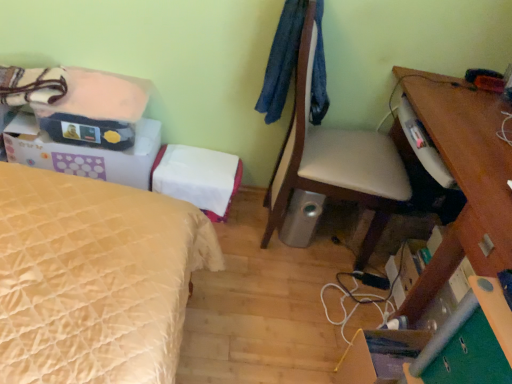
Where is `white cardboard box at upper left, which is the 3th storage box from bottom to top`? white cardboard box at upper left, which is the 3th storage box from bottom to top is located at coordinates (84, 153).

Image resolution: width=512 pixels, height=384 pixels. Describe the element at coordinates (470, 357) in the screenshot. I see `green felt drawer at lower right` at that location.

This screenshot has width=512, height=384. What do you see at coordinates (99, 96) in the screenshot? I see `matte black bag at upper left` at bounding box center [99, 96].

This screenshot has width=512, height=384. Find the location of `white fabric storage box at center, which is counted as the second storage box, starting from the top`. white fabric storage box at center, which is counted as the second storage box, starting from the top is located at coordinates (198, 177).

This screenshot has height=384, width=512. Find the location of `white cardboard box at upper left, marked as the 1th storage box in a top-to-bottom arrangement`. white cardboard box at upper left, marked as the 1th storage box in a top-to-bottom arrangement is located at coordinates (84, 153).

Is silver metallic speaker at lower center in contact with matte black bag at upper left?

They are not placed beside each other.

The width and height of the screenshot is (512, 384). Find the location of `loudspeaker behind the matte black bag at upper left`. loudspeaker behind the matte black bag at upper left is located at coordinates (301, 218).

Can you tell me how much silver metallic speaker at lower center and matte black bag at upper left differ in facing direction?

The angular difference between silver metallic speaker at lower center and matte black bag at upper left is 0.817 degrees.

From the image's perspective, which one is positioned higher, silver metallic speaker at lower center or matte black bag at upper left?

matte black bag at upper left.

Does matte black bag at upper left have a larger size compared to white cardboard box at upper left, marked as the 1th storage box in a top-to-bottom arrangement?

No.

Which of these two, matte black bag at upper left or white cardboard box at upper left, acting as the 1th storage box starting from the left, stands shorter?

matte black bag at upper left is shorter.

From a real-world perspective, is matte black bag at upper left under white cardboard box at upper left, marked as the 1th storage box in a top-to-bottom arrangement?

No, from a real-world perspective, matte black bag at upper left is not beneath white cardboard box at upper left, marked as the 1th storage box in a top-to-bottom arrangement.

Is matte black bag at upper left wider or thinner than white cardboard box at upper left, which is the 3th storage box from bottom to top?

matte black bag at upper left is thinner than white cardboard box at upper left, which is the 3th storage box from bottom to top.

Is matte cardboard box at lower right, arranged as the 3th storage box when viewed from the top, oriented away from silver metallic speaker at lower center?

matte cardboard box at lower right, arranged as the 3th storage box when viewed from the top, does not have its back to silver metallic speaker at lower center.

Does matte cardboard box at lower right, which is counted as the third storage box, starting from the left, have a lesser width compared to silver metallic speaker at lower center?

Yes, matte cardboard box at lower right, which is counted as the third storage box, starting from the left, is thinner than silver metallic speaker at lower center.

From a real-world perspective, who is located lower, matte cardboard box at lower right, the 1th storage box from the bottom, or silver metallic speaker at lower center?

matte cardboard box at lower right, the 1th storage box from the bottom.

What's the angular difference between matte cardboard box at lower right, which is counted as the third storage box, starting from the left, and silver metallic speaker at lower center's facing directions?

They differ by 86.7 degrees in their facing directions.

Is white fabric storage box at center, marked as the 2th storage box in a left-to-right arrangement, at the back of silver metallic speaker at lower center?

That's not correct — silver metallic speaker at lower center is not looking away from white fabric storage box at center, marked as the 2th storage box in a left-to-right arrangement.

Considering the relative sizes of silver metallic speaker at lower center and white fabric storage box at center, marked as the 2th storage box in a left-to-right arrangement, in the image provided, is silver metallic speaker at lower center smaller than white fabric storage box at center, marked as the 2th storage box in a left-to-right arrangement,?

Yes, silver metallic speaker at lower center is smaller than white fabric storage box at center, marked as the 2th storage box in a left-to-right arrangement.

Considering the positions of objects silver metallic speaker at lower center and white fabric storage box at center, placed as the second storage box when sorted from bottom to top, in the image provided, who is more to the right, silver metallic speaker at lower center or white fabric storage box at center, placed as the second storage box when sorted from bottom to top,?

From the viewer's perspective, silver metallic speaker at lower center appears more on the right side.

Considering the positions of points (506, 235) and (305, 242), is point (506, 235) farther from camera compared to point (305, 242)?

No, it is in front of (305, 242).

Based on the photo, considering the positions of objects wooden desk at right and silver metallic speaker at lower center in the image provided, who is behind, wooden desk at right or silver metallic speaker at lower center?

silver metallic speaker at lower center.

Based on their positions, is wooden desk at right located to the left or right of silver metallic speaker at lower center?

Clearly, wooden desk at right is on the right of silver metallic speaker at lower center in the image.

From a real-world perspective, which object rests below the other?

silver metallic speaker at lower center.

Can you confirm if matte cardboard box at lower right, which is counted as the third storage box, starting from the left, is shorter than white fabric storage box at center, marked as the 2th storage box in a left-to-right arrangement?

In fact, matte cardboard box at lower right, which is counted as the third storage box, starting from the left, may be taller than white fabric storage box at center, marked as the 2th storage box in a left-to-right arrangement.

Which point is more distant from viewer, (395,382) or (186,165)?

The point (186,165) is more distant.

Considering the relative sizes of matte cardboard box at lower right, which is counted as the third storage box, starting from the left, and white fabric storage box at center, the 2th storage box when ordered from right to left, in the image provided, is matte cardboard box at lower right, which is counted as the third storage box, starting from the left, bigger than white fabric storage box at center, the 2th storage box when ordered from right to left,?

Actually, matte cardboard box at lower right, which is counted as the third storage box, starting from the left, might be smaller than white fabric storage box at center, the 2th storage box when ordered from right to left.

Which of these two, matte cardboard box at lower right, which is counted as the third storage box, starting from the left, or white fabric storage box at center, the 2th storage box when ordered from right to left, is thinner?

Thinner between the two is matte cardboard box at lower right, which is counted as the third storage box, starting from the left.

How many degrees apart are the facing directions of white fabric storage box at center, placed as the second storage box when sorted from bottom to top, and white leather chair at center?

85.7 degrees.

Between point (217, 161) and point (298, 179), which one is positioned behind?

The point (217, 161) is farther from the camera.

Looking at this image, how much distance is there between white fabric storage box at center, which is counted as the second storage box, starting from the top, and white leather chair at center?

white fabric storage box at center, which is counted as the second storage box, starting from the top, and white leather chair at center are 16.89 inches apart.

I want to click on chair lying on the right of white fabric storage box at center, which is counted as the second storage box, starting from the top, so click(x=334, y=159).

I want to click on sheet above the silver metallic speaker at lower center (from the image's perspective), so click(x=99, y=96).

Identify the location of sheet on the right side of white cardboard box at upper left, arranged as the third storage box when viewed from the right. The width and height of the screenshot is (512, 384). (99, 96).

From the image, which object appears to be nearer to white cardboard box at upper left, which is the 3th storage box from bottom to top, green felt drawer at lower right or silver metallic speaker at lower center?

silver metallic speaker at lower center is positioned closer to the anchor white cardboard box at upper left, which is the 3th storage box from bottom to top.

Looking at the image, which one is located further to white fabric storage box at center, which is counted as the second storage box, starting from the top, white cardboard box at upper left, which is the 3th storage box from bottom to top, or matte cardboard box at lower right, the first storage box in the right-to-left sequence?

Based on the image, matte cardboard box at lower right, the first storage box in the right-to-left sequence, appears to be further to white fabric storage box at center, which is counted as the second storage box, starting from the top.

When comparing their distances from green felt drawer at lower right, does white cardboard box at upper left, marked as the 1th storage box in a top-to-bottom arrangement, or silver metallic speaker at lower center seem further?

Among the two, white cardboard box at upper left, marked as the 1th storage box in a top-to-bottom arrangement, is located further to green felt drawer at lower right.

Which object lies further to the anchor point matte black bag at upper left, white leather chair at center or white fabric storage box at center, placed as the second storage box when sorted from bottom to top?

white leather chair at center.

Which object lies further to the anchor point white fabric storage box at center, the 2th storage box when ordered from right to left, matte black bag at upper left or wooden desk at right?

Based on the image, wooden desk at right appears to be further to white fabric storage box at center, the 2th storage box when ordered from right to left.

Based on their spatial positions, is silver metallic speaker at lower center or matte cardboard box at lower right, the first storage box in the right-to-left sequence, further from wooden desk at right?

silver metallic speaker at lower center lies further to wooden desk at right than the other object.

Based on their spatial positions, is green felt drawer at lower right or matte black bag at upper left further from white fabric storage box at center, which is counted as the second storage box, starting from the top?

Based on the image, green felt drawer at lower right appears to be further to white fabric storage box at center, which is counted as the second storage box, starting from the top.

Looking at the image, which one is located closer to white cardboard box at upper left, marked as the 1th storage box in a top-to-bottom arrangement, silver metallic speaker at lower center or wooden desk at right?

silver metallic speaker at lower center lies closer to white cardboard box at upper left, marked as the 1th storage box in a top-to-bottom arrangement, than the other object.

Where is `loudspeaker located between white cardboard box at upper left, arranged as the third storage box when viewed from the right, and green felt drawer at lower right in the left-right direction`? loudspeaker located between white cardboard box at upper left, arranged as the third storage box when viewed from the right, and green felt drawer at lower right in the left-right direction is located at coordinates (301, 218).

The image size is (512, 384). I want to click on loudspeaker located between white cardboard box at upper left, marked as the 1th storage box in a top-to-bottom arrangement, and wooden desk at right in the left-right direction, so click(301, 218).

You are a GUI agent. You are given a task and a screenshot of the screen. Output one action in this format:
    pyautogui.click(x=<x>, y=<y>)
    Task: Click on the drawer between white leather chair at center and matte cardboard box at lower right, arranged as the 3th storage box when viewed from the top, vertically
    
    Given the screenshot: What is the action you would take?
    pyautogui.click(x=470, y=357)

Find the location of a particular element. This screenshot has height=384, width=512. storage box between white cardboard box at upper left, marked as the 1th storage box in a top-to-bottom arrangement, and matte cardboard box at lower right, arranged as the 3th storage box when viewed from the top, from left to right is located at coordinates (198, 177).